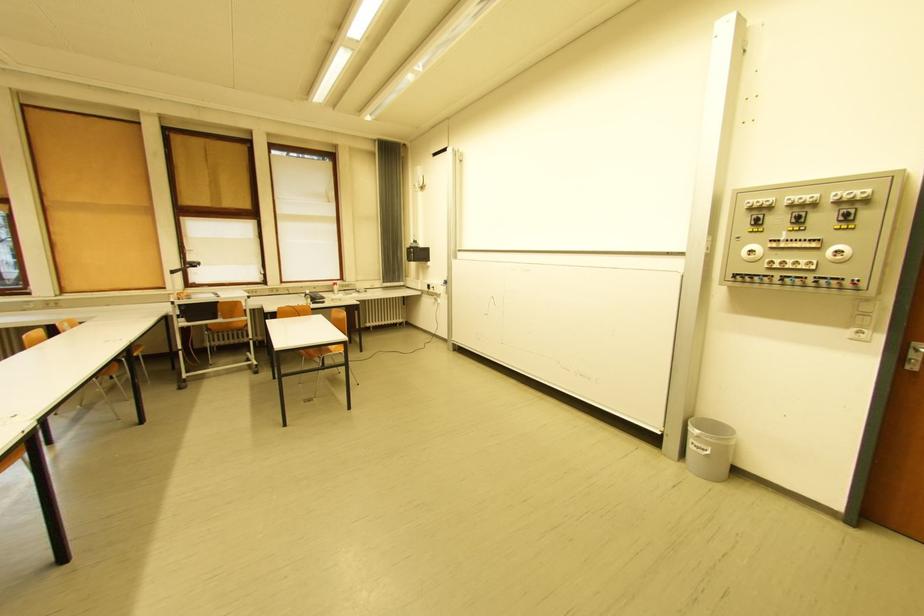
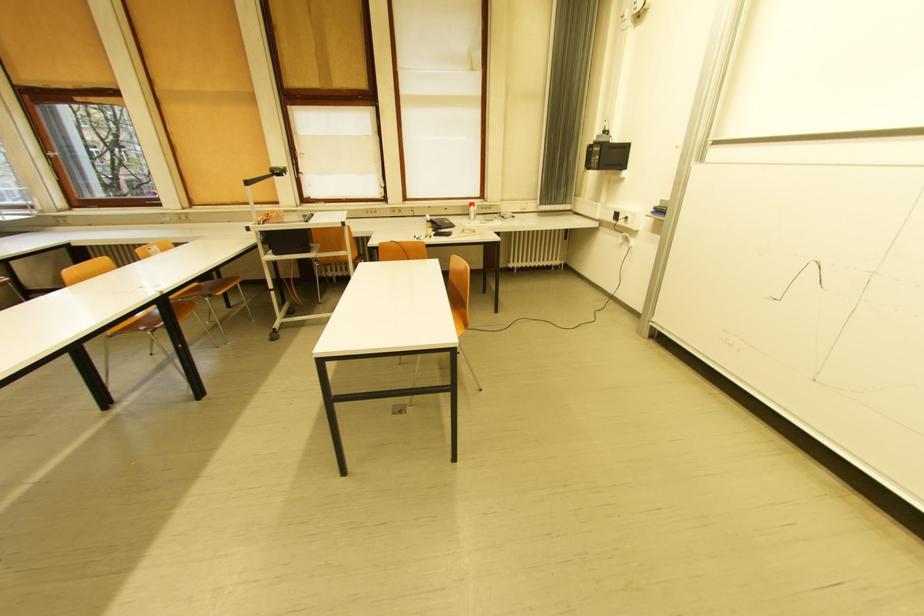
Question: In a continuous first-person perspective shot, in which direction is the camera moving?

Choices:
 (A) Left
 (B) Right
 (C) Forward
 (D) Backward

Answer: (C)